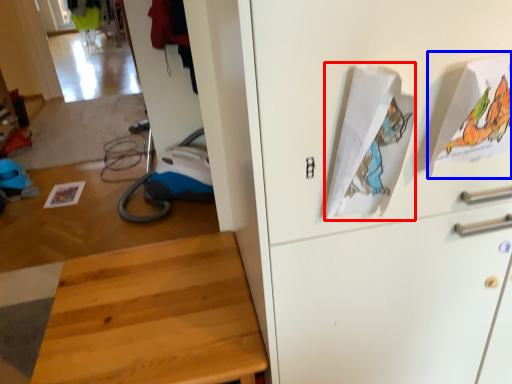
Question: Which of the following is the farthest to the observer, wrapping paper (highlighted by a red box) or wrapping paper (highlighted by a blue box)?

Choices:
 (A) wrapping paper
 (B) wrapping paper

Answer: (B)